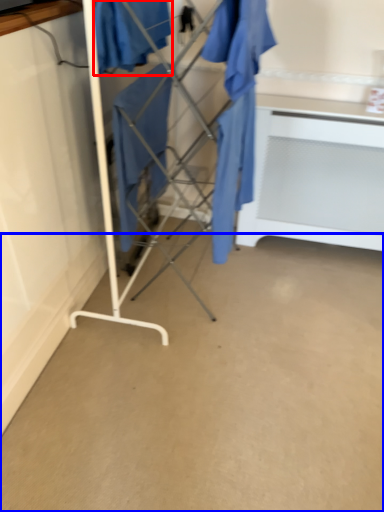
Question: Which point is further to the camera, clothing (highlighted by a red box) or concrete (highlighted by a blue box)?

Choices:
 (A) clothing
 (B) concrete

Answer: (A)